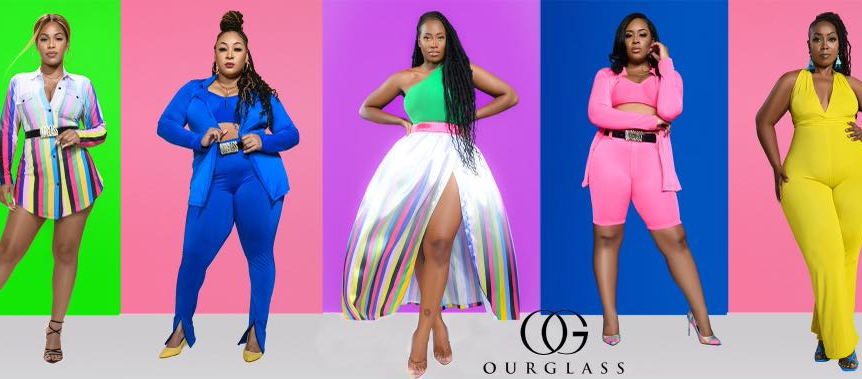
In order to click on shoe in this screenshot , I will do `click(53, 351)`, `click(175, 348)`, `click(255, 354)`, `click(419, 369)`, `click(452, 358)`, `click(611, 342)`, `click(715, 340)`, `click(815, 357)`, `click(852, 366)`.